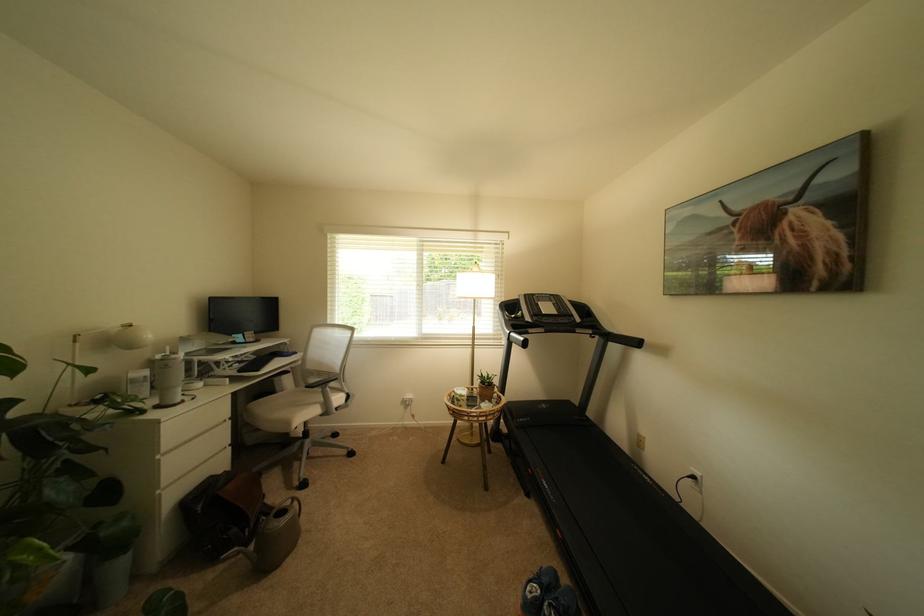
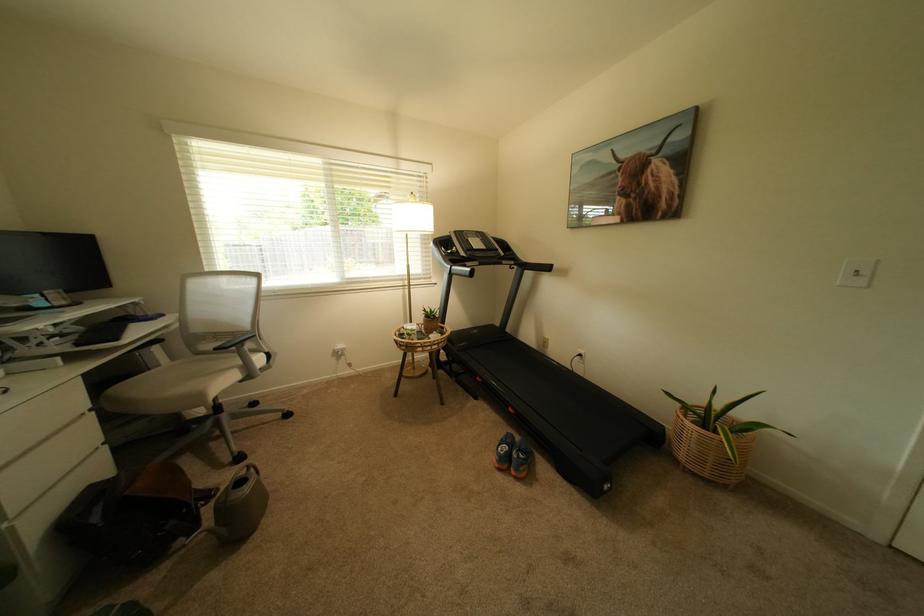
The point at (298, 503) is marked in the first image. Where is the corresponding point in the second image?

(253, 471)